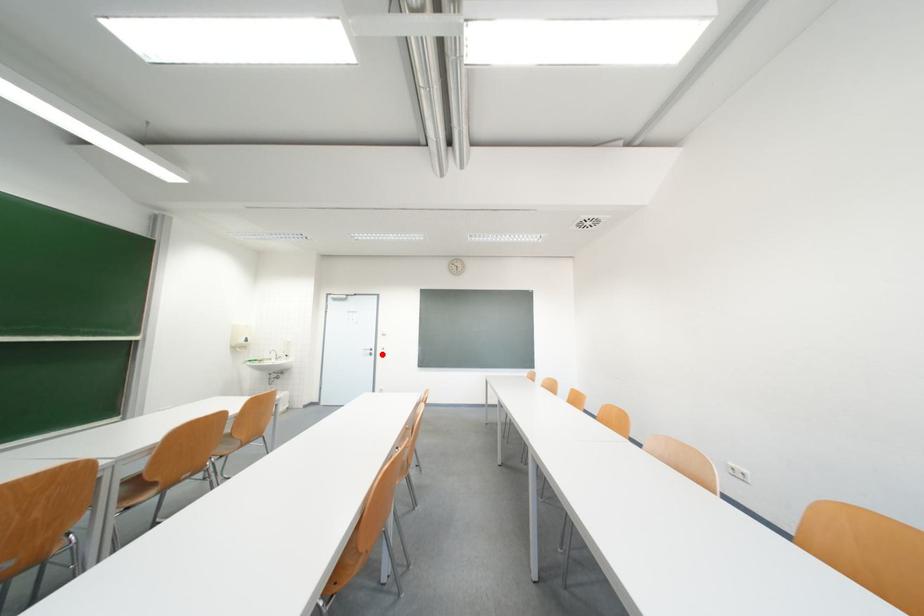
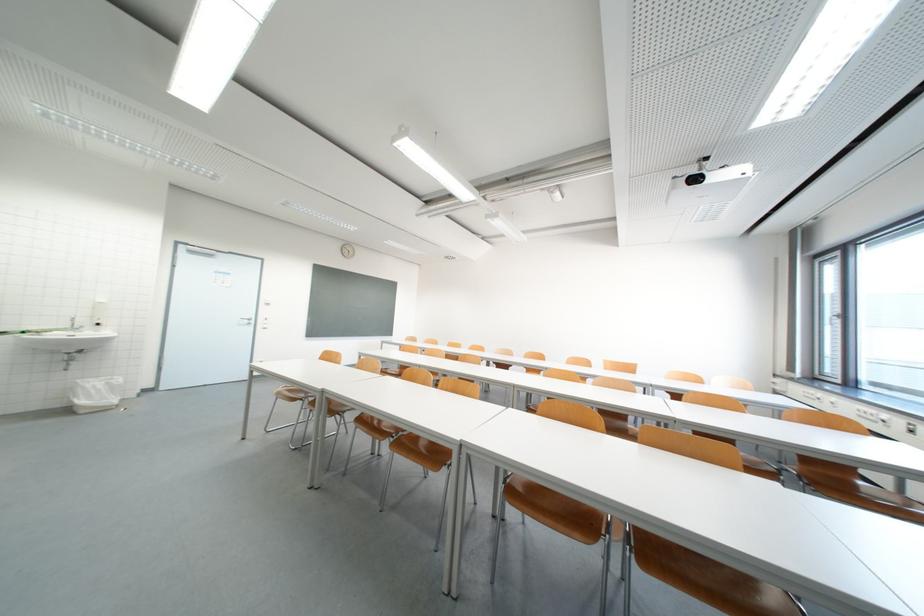
Question: I am providing you with two images of the same scene from different viewpoints. In image1, a red point is highlighted. Considering the same 3D point in image2, which of the following is correct?

Choices:
 (A) It is closer
 (B) It is farther

Answer: (A)